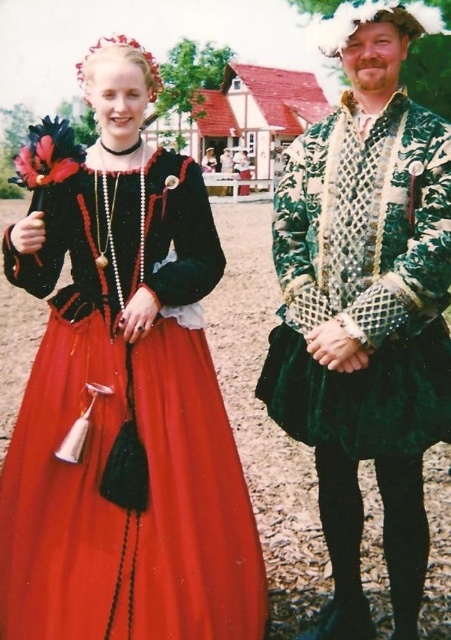
You are a photographer setting up for a Renaissance fair photoshoot. You need to ensure that both the matte black dress at center and the velvet green coat at center are visible in the frame. Based on their positions, which one should you focus on first to ensure it doesn t get obscured?

The matte black dress at center is positioned under the velvet green coat at center. To prevent the matte black dress at center from being obscured, focus on the velvet green coat at center first, then adjust to capture the matte black dress at center below it.

You are a photographer standing at a certain distance from the matte black dress at center. You need to capture a closeup shot of the dress without using a zoom lens. What is the minimum distance you should move towards the dress to achieve this?

The minimum distance you should move towards the matte black dress at center is 2.70 meters minus the desired closeup distance, but since the current distance is 2.70 meters, you can move closer to achieve the closeup without zoom.

You are a costume designer observing the Renaissance scene. You need to determine which costume is shorter between the matte black dress at center and the velvet green coat at center. Which one is shorter?

The matte black dress at center is shorter than the velvet green coat at center according to the description provided.